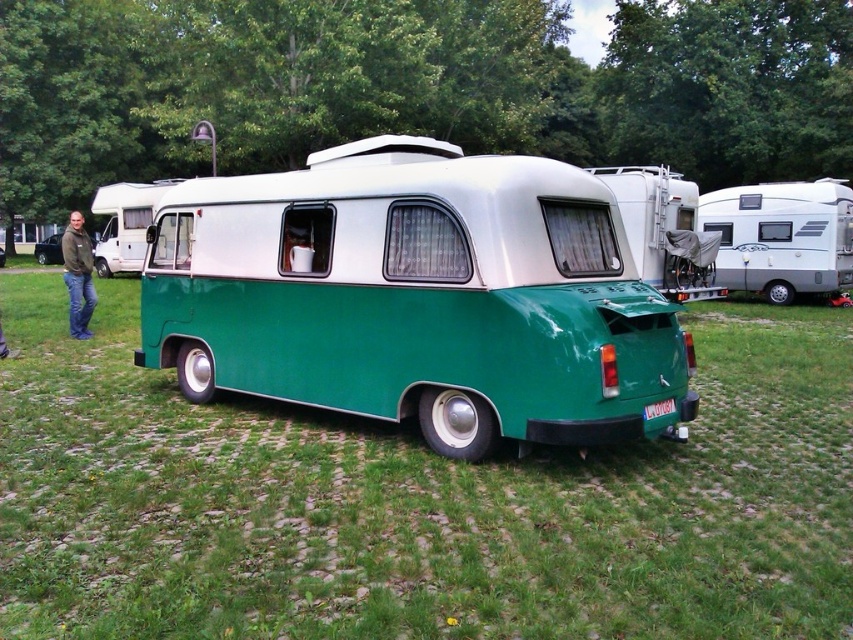
Question: Which of the following is the closest to the observer?

Choices:
 (A) (654, 253)
 (B) (149, 204)

Answer: (A)

Question: In this image, where is white glossy camper van at right located relative to green matte van at center?

Choices:
 (A) right
 (B) left

Answer: (A)

Question: Where is green glossy recreational vehicle at center located in relation to white plastic camper van at left in the image?

Choices:
 (A) above
 (B) below

Answer: (B)

Question: Can you confirm if green matte grass at center is bigger than white plastic camper van at left?

Choices:
 (A) yes
 (B) no

Answer: (B)

Question: Which of the following is the closest to the observer?

Choices:
 (A) pos(155,189)
 (B) pos(363,412)
 (C) pos(78,285)
 (D) pos(608,538)

Answer: (D)

Question: Among these objects, which one is farthest from the camera?

Choices:
 (A) white plastic camper van at left
 (B) green matte van at center

Answer: (B)